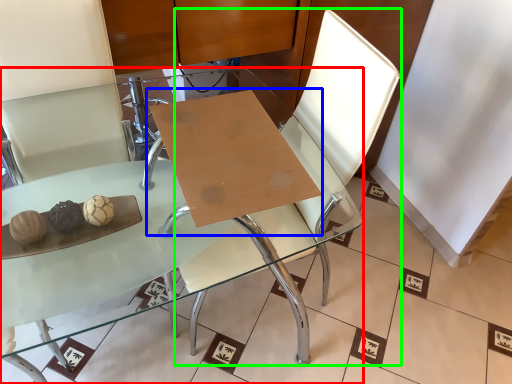
Question: Based on their relative distances, which object is farther from table (highlighted by a red box)? Choose from table (highlighted by a blue box) and swivel chair (highlighted by a green box).

Choices:
 (A) table
 (B) swivel chair

Answer: (A)